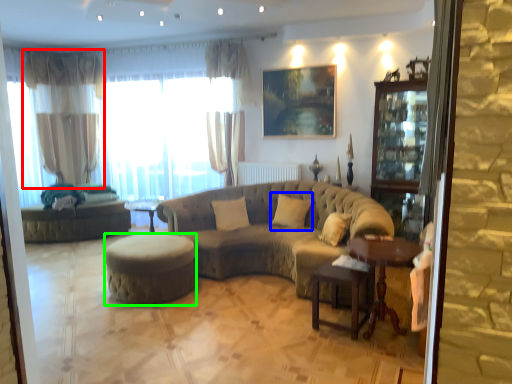
Question: Which object is the closest to the curtain (highlighted by a red box)? Choose among these: pillow (highlighted by a blue box) or stool (highlighted by a green box).

Choices:
 (A) pillow
 (B) stool

Answer: (B)